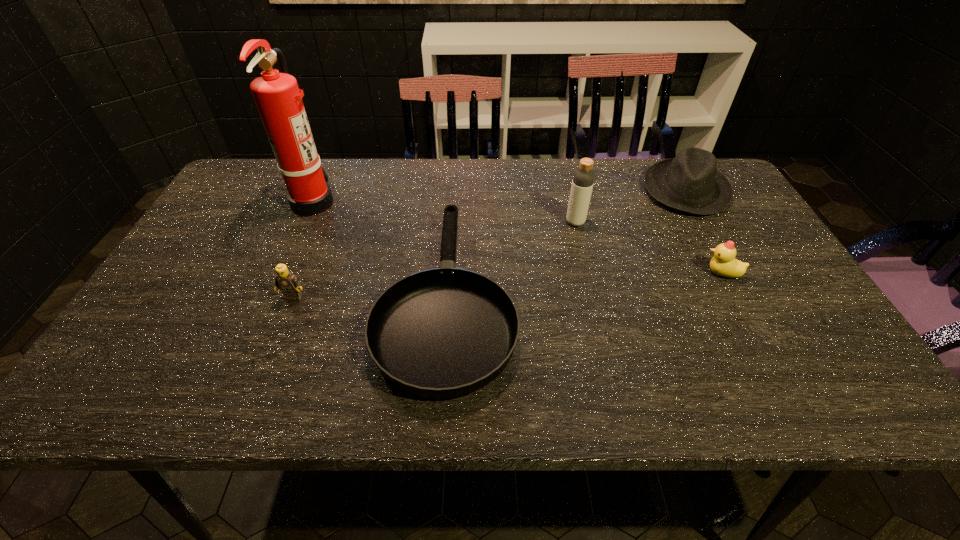
The width and height of the screenshot is (960, 540). Find the location of `blank region between the fedora and the third object from left to right`. blank region between the fedora and the third object from left to right is located at coordinates (566, 244).

Identify the location of free space between the fedora and the second tallest object. Image resolution: width=960 pixels, height=540 pixels. (631, 206).

Identify the location of vacant area that lies between the shortest object and the duckling. (585, 285).

You are a GUI agent. You are given a task and a screenshot of the screen. Output one action in this format:
    pyautogui.click(x=<x>, y=<y>)
    Task: Click on the free spot between the duckling and the Lego
    The width and height of the screenshot is (960, 540).
    Given the screenshot: What is the action you would take?
    pyautogui.click(x=508, y=285)

The height and width of the screenshot is (540, 960). I want to click on free area in between the third object from left to right and the fire extinguisher, so click(380, 249).

Find the location of a particular element. The height and width of the screenshot is (540, 960). unoccupied area between the Lego and the fire extinguisher is located at coordinates (303, 249).

The height and width of the screenshot is (540, 960). What are the coordinates of `vacant region between the Lego and the tallest object` in the screenshot? It's located at (303, 249).

Point out which object is positioned as the third nearest to the duckling. Please provide its 2D coordinates. Your answer should be formatted as a tuple, i.e. [(x, y)], where the tuple contains the x and y coordinates of a point satisfying the conditions above.

[(445, 332)]

Where is `object that ranks as the fourth closest to the duckling`? object that ranks as the fourth closest to the duckling is located at coordinates (288, 283).

Where is `free spot that satisfies the following two spatial constraints: 1. on the front-facing side of the duckling; 2. in front of the Lego`? The height and width of the screenshot is (540, 960). free spot that satisfies the following two spatial constraints: 1. on the front-facing side of the duckling; 2. in front of the Lego is located at coordinates (734, 297).